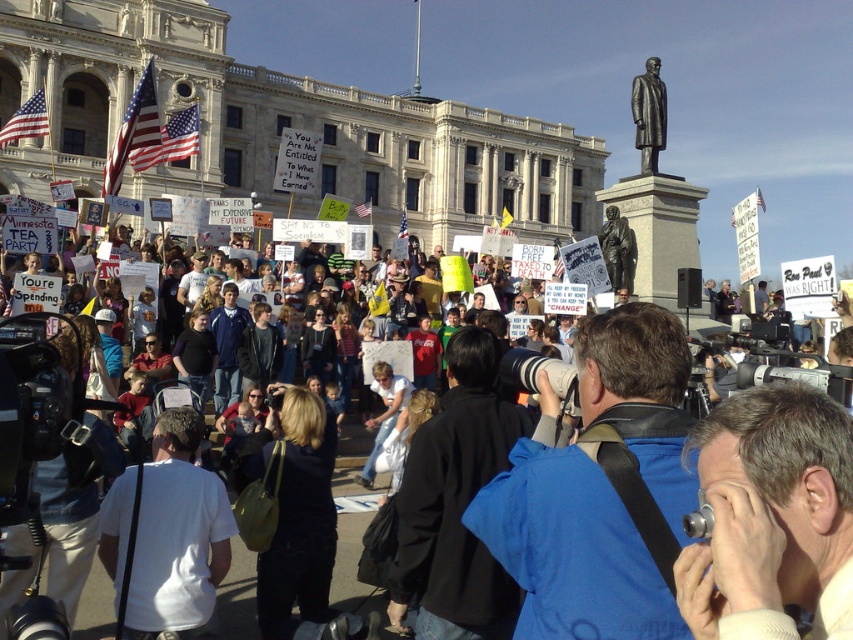
Does blue fabric camera at center appear on the right side of bronze statue at upper center?

Incorrect, blue fabric camera at center is not on the right side of bronze statue at upper center.

Does blue fabric camera at center appear on the left side of bronze statue at upper center?

Yes, blue fabric camera at center is to the left of bronze statue at upper center.

Between point (674, 493) and point (662, 131), which one is positioned in front?

Positioned in front is point (674, 493).

The height and width of the screenshot is (640, 853). Find the location of `blue fabric camera at center`. blue fabric camera at center is located at coordinates (570, 541).

Is bronze statue at upper center to the left of bronze statue at center from the viewer's perspective?

Incorrect, bronze statue at upper center is not on the left side of bronze statue at center.

Which is more to the right, bronze statue at upper center or bronze statue at center?

Positioned to the right is bronze statue at upper center.

Is point (651, 90) positioned after point (631, 237)?

Yes, point (651, 90) is farther from viewer.

Where is `bronze statue at upper center`? The image size is (853, 640). bronze statue at upper center is located at coordinates (648, 115).

Consider the image. Between blue fabric camera at center and bronze statue at center, which one is positioned lower?

blue fabric camera at center

Image resolution: width=853 pixels, height=640 pixels. I want to click on blue fabric camera at center, so (x=570, y=541).

Locate an element on the screen. This screenshot has height=640, width=853. blue fabric camera at center is located at coordinates (570, 541).